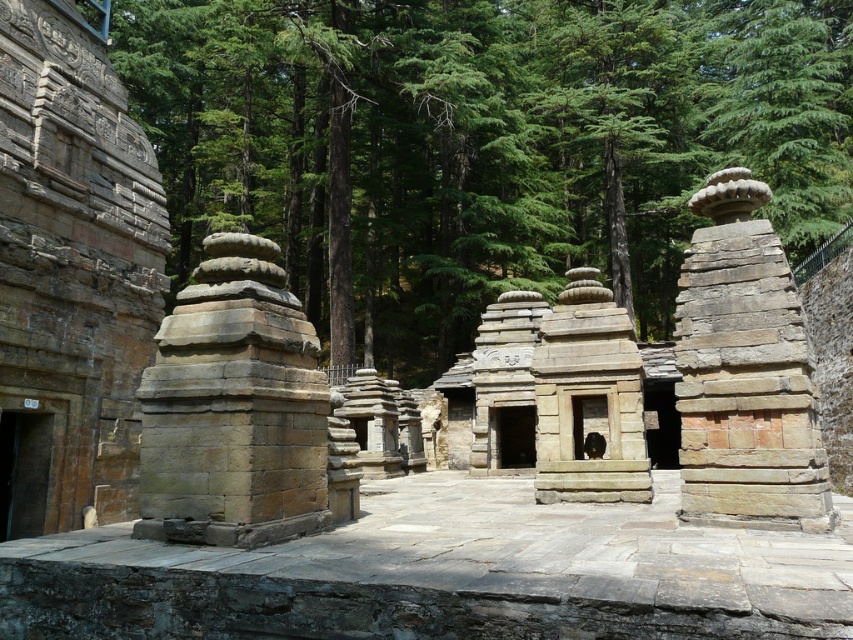
Question: Which of the following is the closest to the observer?

Choices:
 (A) (495, 68)
 (B) (811, 474)
 (C) (589, 362)

Answer: (B)

Question: Is brown stone stupa at center-right to the right of natural stone temple at center from the viewer's perspective?

Choices:
 (A) no
 (B) yes

Answer: (B)

Question: Which point appears farthest from the camera in this image?

Choices:
 (A) (585, 480)
 (B) (154, 113)

Answer: (B)

Question: Does green stone trees at center have a lesser width compared to natural stone temple at center?

Choices:
 (A) no
 (B) yes

Answer: (A)

Question: Which point is closer to the camera?

Choices:
 (A) (405, 202)
 (B) (610, 344)
 (C) (704, 280)

Answer: (C)

Question: Does green stone trees at center have a larger size compared to brown stone stupa at center-right?

Choices:
 (A) no
 (B) yes

Answer: (B)